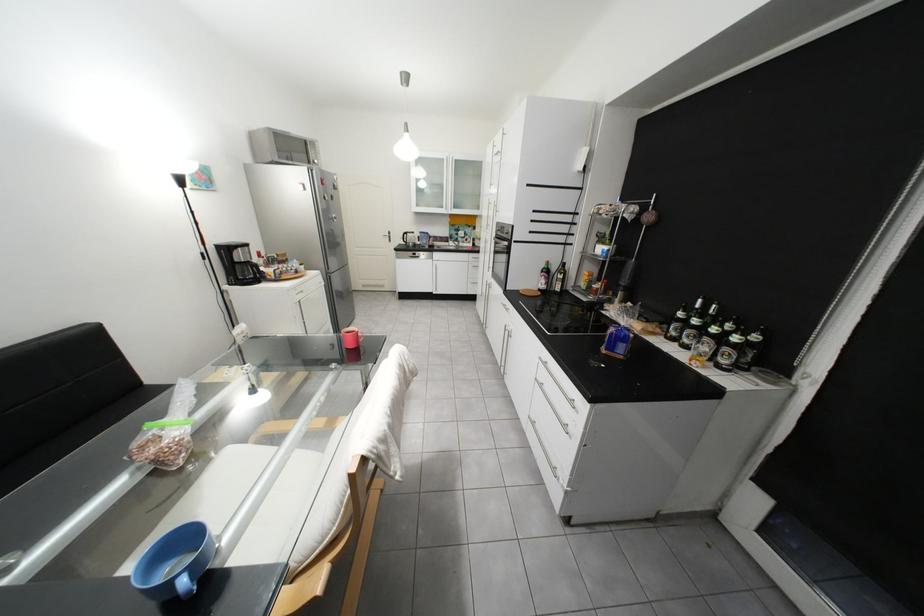
At what (x,y) coordinates should I click in order to perform the action: click on faucet handle. Please return your answer as a coordinate pair (x, y). Looking at the image, I should click on (440, 243).